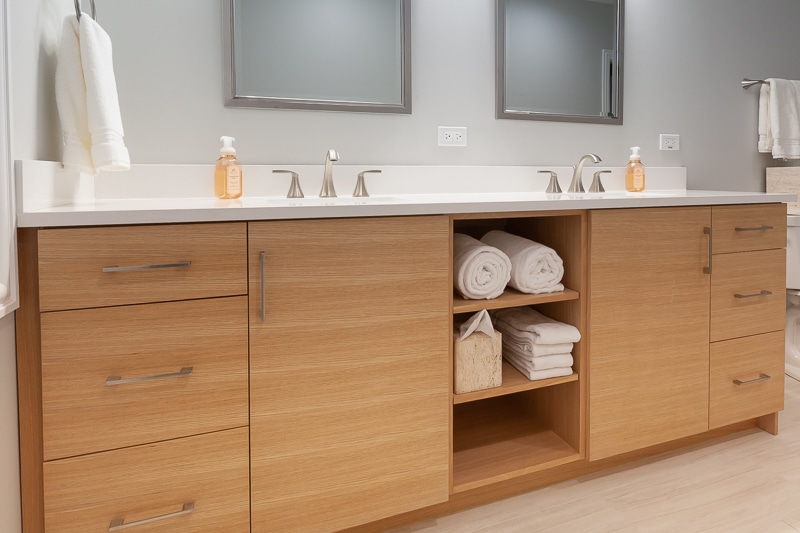
Locate an element on the screen. The height and width of the screenshot is (533, 800). left mirror is located at coordinates (330, 60).